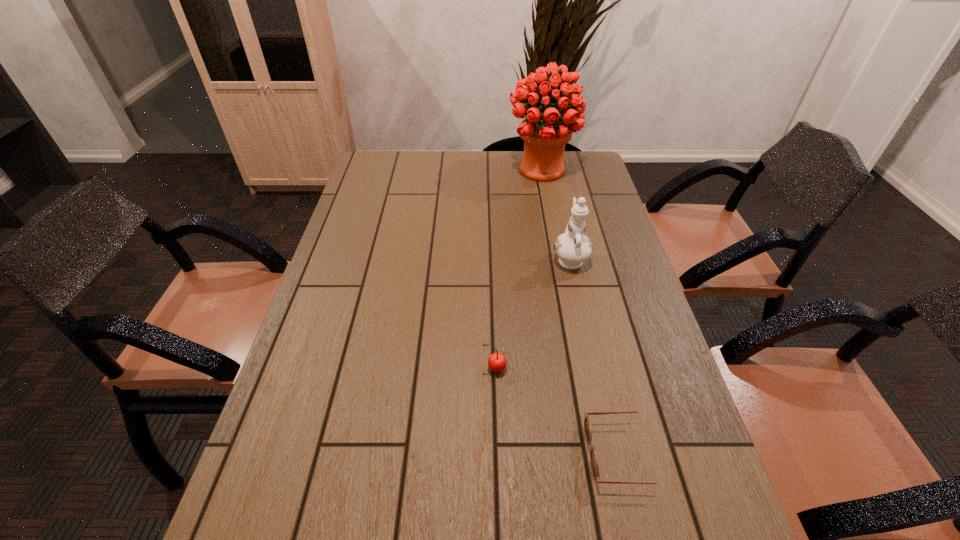
Where is `free space located 0.140m at the spout of the third nearest object`? This screenshot has width=960, height=540. free space located 0.140m at the spout of the third nearest object is located at coordinates (561, 216).

Image resolution: width=960 pixels, height=540 pixels. Identify the location of vacant space located 0.100m at the spout of the third nearest object. (563, 224).

This screenshot has height=540, width=960. Identify the location of free space located on the front of the third farthest object. (497, 457).

I want to click on vacant area situated on the front-facing side of the shortest object, so click(x=414, y=454).

In order to click on free space located on the front-facing side of the shortest object in this screenshot , I will do `click(548, 454)`.

This screenshot has height=540, width=960. In order to click on vacant space situated on the front-facing side of the shortest object in this screenshot , I will do `click(543, 454)`.

Identify the location of object at the far edge. The image size is (960, 540). (545, 132).

You are a GUI agent. You are given a task and a screenshot of the screen. Output one action in this format:
    pyautogui.click(x=<x>, y=<y>)
    Task: Click on the bouquet that is at the right edge
    
    Given the screenshot: What is the action you would take?
    pyautogui.click(x=545, y=132)

The width and height of the screenshot is (960, 540). Find the location of `chinaware that is at the right edge`. chinaware that is at the right edge is located at coordinates (572, 247).

Where is `sunglasses that is positioned at the right edge`? This screenshot has width=960, height=540. sunglasses that is positioned at the right edge is located at coordinates (587, 426).